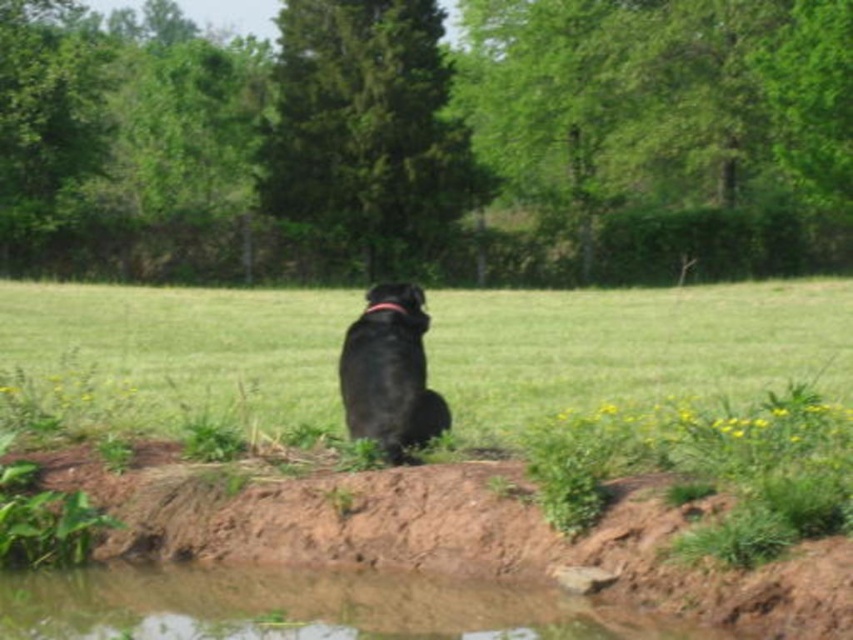
Question: Among these objects, which one is nearest to the camera?

Choices:
 (A) black matte dog at center
 (B) clear water at lower center
 (C) green grass at center

Answer: (B)

Question: Is green grass at center positioned behind clear water at lower center?

Choices:
 (A) no
 (B) yes

Answer: (B)

Question: Which of the following is the farthest from the observer?

Choices:
 (A) green grass at center
 (B) clear water at lower center
 (C) black matte dog at center

Answer: (A)

Question: Does green grass at center have a greater width compared to clear water at lower center?

Choices:
 (A) yes
 (B) no

Answer: (A)

Question: Estimate the real-world distances between objects in this image. Which object is closer to the clear water at lower center?

Choices:
 (A) black matte dog at center
 (B) green grass at center

Answer: (A)

Question: Does clear water at lower center have a lesser width compared to black matte dog at center?

Choices:
 (A) yes
 (B) no

Answer: (B)